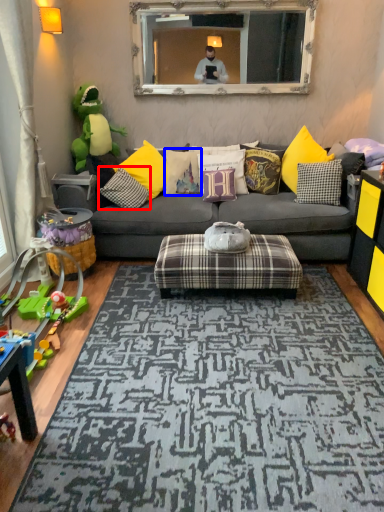
Question: Which object appears farthest to the camera in this image, pillow (highlighted by a red box) or pillow (highlighted by a blue box)?

Choices:
 (A) pillow
 (B) pillow

Answer: (B)